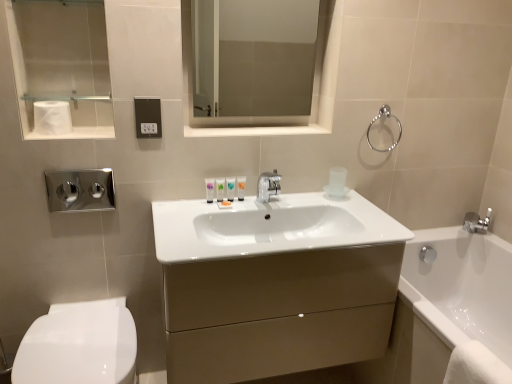
What is the approximate height of white matte toilet paper at upper left?

white matte toilet paper at upper left is 4.41 inches in height.

This screenshot has height=384, width=512. What do you see at coordinates (52, 117) in the screenshot? I see `white matte toilet paper at upper left` at bounding box center [52, 117].

What do you see at coordinates (80, 190) in the screenshot? I see `brushed metal flush plate at left` at bounding box center [80, 190].

Where is `white glossy tube at center, which is the 1th toiletry from right to left`? white glossy tube at center, which is the 1th toiletry from right to left is located at coordinates (241, 187).

In order to face white glossy toilet at lower left, should I rotate leftwards or rightwards?

You should rotate left by 21.698 degrees.

Locate an element on the screen. The height and width of the screenshot is (384, 512). white matte toilet paper at upper left is located at coordinates (52, 117).

Locate an element on the screen. This screenshot has height=384, width=512. electric outlet behind the matte beige cabinet at center is located at coordinates (148, 117).

Does matte beige cabinet at center have a smaller size compared to black plastic outlet at center?

No, matte beige cabinet at center is not smaller than black plastic outlet at center.

Which object is wider, matte beige cabinet at center or black plastic outlet at center?

Wider between the two is matte beige cabinet at center.

Is matte beige cabinet at center facing away from black plastic outlet at center?

No, matte beige cabinet at center is not facing away from black plastic outlet at center.

Which object is further away from the camera taking this photo, polished chrome faucet at lower right or silver metallic towel ring at upper right?

polished chrome faucet at lower right is behind.

Where is `towel bar above the polished chrome faucet at lower right (from the image's perspective)`? The width and height of the screenshot is (512, 384). towel bar above the polished chrome faucet at lower right (from the image's perspective) is located at coordinates (384, 119).

Does point (482, 226) come in front of point (366, 135)?

No, (482, 226) is further to viewer.

From a real-world perspective, is polished chrome faucet at lower right beneath silver metallic towel ring at upper right?

Yes, from a real-world perspective, polished chrome faucet at lower right is beneath silver metallic towel ring at upper right.

Does white glossy tube at center, positioned as the second toiletry in left-to-right order, come in front of transparent glass medicine cabinet at upper center?

No.

Looking at their sizes, would you say white glossy tube at center, acting as the 3th toiletry starting from the right, is wider or thinner than transparent glass medicine cabinet at upper center?

Clearly, white glossy tube at center, acting as the 3th toiletry starting from the right, has more width compared to transparent glass medicine cabinet at upper center.

Is white glossy tube at center, acting as the 3th toiletry starting from the right, taller or shorter than transparent glass medicine cabinet at upper center?

Considering their sizes, white glossy tube at center, acting as the 3th toiletry starting from the right, has less height than transparent glass medicine cabinet at upper center.

From a real-world perspective, is white glossy tube at center, acting as the 3th toiletry starting from the right, over transparent glass medicine cabinet at upper center?

No, from a real-world perspective, white glossy tube at center, acting as the 3th toiletry starting from the right, is not on top of transparent glass medicine cabinet at upper center.

Is silver metallic towel ring at upper right facing away from white glossy toilet at lower left?

No, white glossy toilet at lower left is not at the back of silver metallic towel ring at upper right.

From a real-world perspective, between silver metallic towel ring at upper right and white glossy toilet at lower left, who is vertically lower?

From a 3D spatial view, white glossy toilet at lower left is below.

Find the location of a particular element. This screenshot has height=384, width=512. towel bar above the white glossy toilet at lower left (from the image's perspective) is located at coordinates (384, 119).

Can you confirm if silver metallic towel ring at upper right is thinner than white glossy toilet at lower left?

Indeed, silver metallic towel ring at upper right has a lesser width compared to white glossy toilet at lower left.

Can you confirm if white matte toilet paper at upper left is positioned to the left of polished chrome faucet at lower right?

Yes.

Considering the relative sizes of white matte toilet paper at upper left and polished chrome faucet at lower right in the image provided, is white matte toilet paper at upper left taller than polished chrome faucet at lower right?

Yes, white matte toilet paper at upper left is taller than polished chrome faucet at lower right.

Looking at this image, from the image's perspective, is white matte toilet paper at upper left above or below polished chrome faucet at lower right?

Based on their image positions, white matte toilet paper at upper left is located above polished chrome faucet at lower right.

Considering the positions of point (50, 102) and point (485, 233), is point (50, 102) closer or farther from the camera than point (485, 233)?

Clearly, point (50, 102) is closer to the camera than point (485, 233).

From a real-world perspective, is polished chrome faucet at lower right located higher than brushed metal flush plate at left?

No.

Is polished chrome faucet at lower right in front of or behind brushed metal flush plate at left in the image?

Visually, polished chrome faucet at lower right is located behind brushed metal flush plate at left.

Which is in front, point (474, 225) or point (93, 173)?

The point (93, 173) is closer to the camera.

Considering the sizes of black plastic outlet at center and white matte toilet paper at upper left in the image, is black plastic outlet at center wider or thinner than white matte toilet paper at upper left?

Clearly, black plastic outlet at center has less width compared to white matte toilet paper at upper left.

From the image's perspective, would you say black plastic outlet at center is positioned over white matte toilet paper at upper left?

No, from the image's perspective, black plastic outlet at center is not on top of white matte toilet paper at upper left.

Is point (144, 128) farther from viewer compared to point (52, 102)?

Yes, point (144, 128) is behind point (52, 102).

Find the location of a particular element. The width and height of the screenshot is (512, 384). bathroom cabinet below the black plastic outlet at center (from a real-world perspective) is located at coordinates (275, 285).

What are the coordinates of `tap located on the right of silver metallic towel ring at upper right` in the screenshot? It's located at (476, 222).

Based on their spatial positions, is transparent glass medicine cabinet at upper center or white matte toilet paper at upper left further from brushed metal towel bar at upper left?

transparent glass medicine cabinet at upper center.

Estimate the real-world distances between objects in this image. Which object is further from matte purple tube at center, placed as the 1th toiletry when sorted from left to right, white glossy tube at center, which is the 1th toiletry from right to left, or white glossy tube at center, positioned as the second toiletry in left-to-right order?

white glossy tube at center, which is the 1th toiletry from right to left, is further to matte purple tube at center, placed as the 1th toiletry when sorted from left to right.

Looking at the image, which one is located further to brushed metal towel bar at upper left, matte beige cabinet at center or white glossy tube at center, which is the 1th toiletry from right to left?

matte beige cabinet at center is further to brushed metal towel bar at upper left.

Looking at the image, which one is located closer to silver metallic towel ring at upper right, black plastic outlet at center or white matte toilet paper at upper left?

black plastic outlet at center.

Estimate the real-world distances between objects in this image. Which object is closer to polished chrome faucet at lower right, brushed metal flush plate at left or matte beige cabinet at center?

matte beige cabinet at center lies closer to polished chrome faucet at lower right than the other object.

Considering their positions, is brushed metal towel bar at upper left positioned closer to white glossy tube at center, which is the 4th toiletry in left-to-right order, than black plastic outlet at center?

black plastic outlet at center is positioned closer to the anchor white glossy tube at center, which is the 4th toiletry in left-to-right order.

Considering their positions, is white glossy toilet at lower left positioned closer to white matte toilet paper at upper left than brushed metal flush plate at left?

brushed metal flush plate at left is closer to white matte toilet paper at upper left.

Which object lies further to the anchor point black plastic outlet at center, transparent glass medicine cabinet at upper center or brushed metal flush plate at left?

transparent glass medicine cabinet at upper center is positioned further to the anchor black plastic outlet at center.

This screenshot has height=384, width=512. Find the location of `medicine cabinet situated between brushed metal flush plate at left and silver metallic towel ring at upper right from left to right`. medicine cabinet situated between brushed metal flush plate at left and silver metallic towel ring at upper right from left to right is located at coordinates (272, 126).

Locate an element on the screen. This screenshot has height=384, width=512. bathroom cabinet that lies between white glossy tube at center, acting as the 3th toiletry starting from the right, and white glossy toilet at lower left from top to bottom is located at coordinates (275, 285).

Where is `toilet paper between brushed metal towel bar at upper left and brushed metal flush plate at left in the vertical direction`? toilet paper between brushed metal towel bar at upper left and brushed metal flush plate at left in the vertical direction is located at coordinates (52, 117).

Find the location of `toilet located between white matte toilet paper at upper left and silver metallic towel ring at upper right in the left-right direction`. toilet located between white matte toilet paper at upper left and silver metallic towel ring at upper right in the left-right direction is located at coordinates (79, 345).